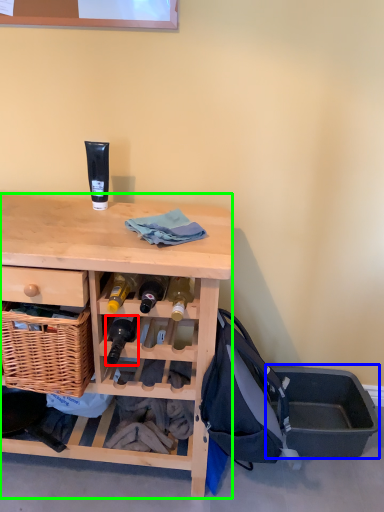
Question: Based on their relative distances, which object is nearer to bottle (highlighted by a red box)? Choose from storage box (highlighted by a blue box) and desk (highlighted by a green box).

Choices:
 (A) storage box
 (B) desk

Answer: (B)